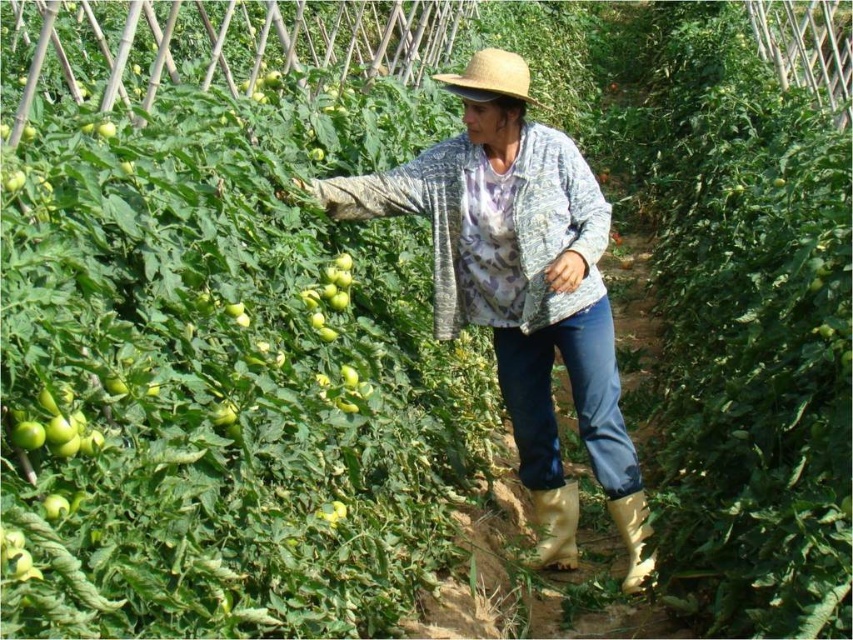
Question: From the image, what is the correct spatial relationship of denim jacket at center in relation to yellow rubber boot at lower center?

Choices:
 (A) above
 (B) below

Answer: (A)

Question: Which object is positioned farthest from the straw hat at center?

Choices:
 (A) green matte tomato at center
 (B) yellow rubber boot at lower right

Answer: (B)

Question: Estimate the real-world distances between objects in this image. Which object is closer to the straw hat at center?

Choices:
 (A) denim jacket at center
 (B) yellow rubber boot at lower right
 (C) green matte tomato at center
 (D) yellow rubber boot at lower center

Answer: (A)

Question: Considering the relative positions of denim jacket at center and green matte tomato at center in the image provided, where is denim jacket at center located with respect to green matte tomato at center?

Choices:
 (A) right
 (B) left

Answer: (A)

Question: Which object appears farthest from the camera in this image?

Choices:
 (A) yellow rubber boot at lower right
 (B) denim jacket at center
 (C) straw hat at center

Answer: (A)

Question: Where is denim jacket at center located in relation to yellow rubber boot at lower center in the image?

Choices:
 (A) left
 (B) right

Answer: (A)